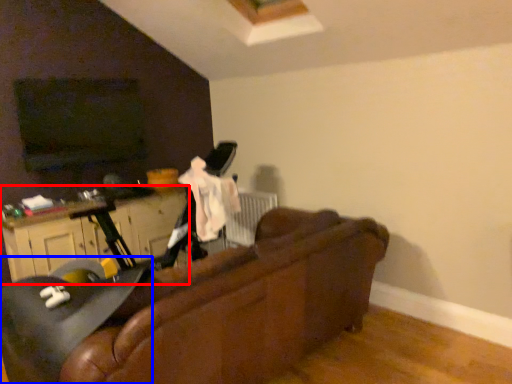
Question: Among these objects, which one is nearest to the camera, dresser (highlighted by a red box) or swivel chair (highlighted by a blue box)?

Choices:
 (A) dresser
 (B) swivel chair

Answer: (B)